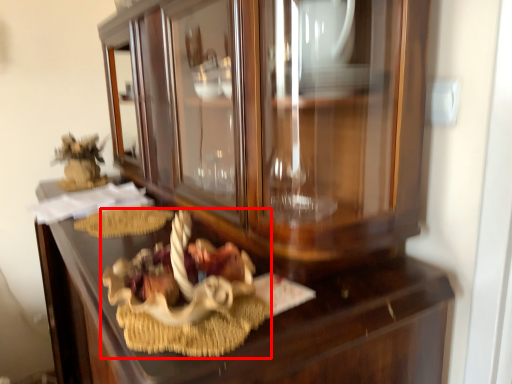
Question: In this image, where is stuff (annotated by the red box) located relative to drawer?

Choices:
 (A) left
 (B) right

Answer: (B)